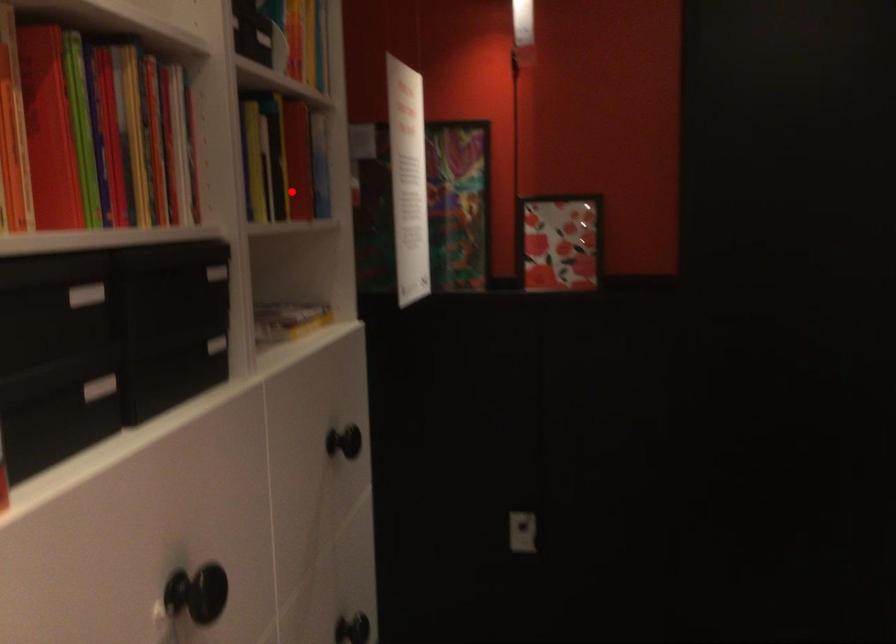
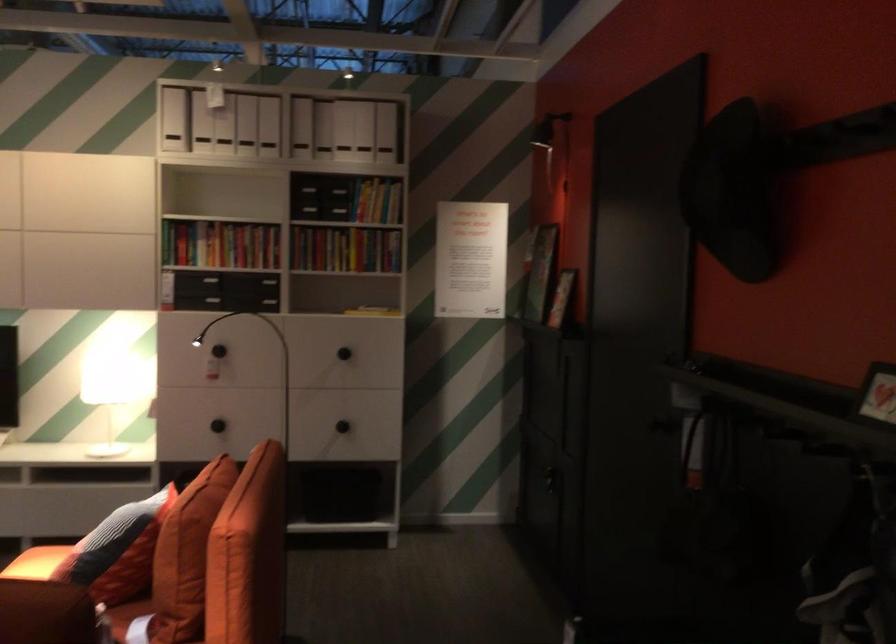
The point at the highlighted location is marked in the first image. Where is the corresponding point in the second image?

(345, 249)